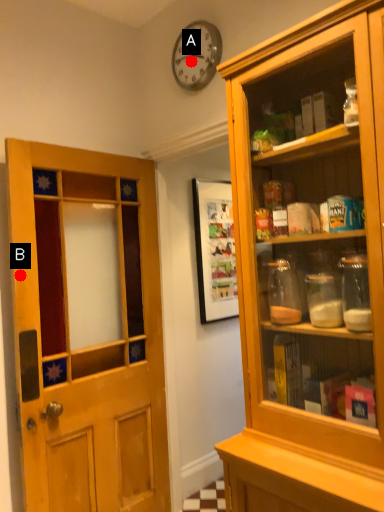
Question: Two points are circled on the image, labeled by A and B beside each circle. Which point is farther to the camera?

Choices:
 (A) A is further
 (B) B is further

Answer: (A)